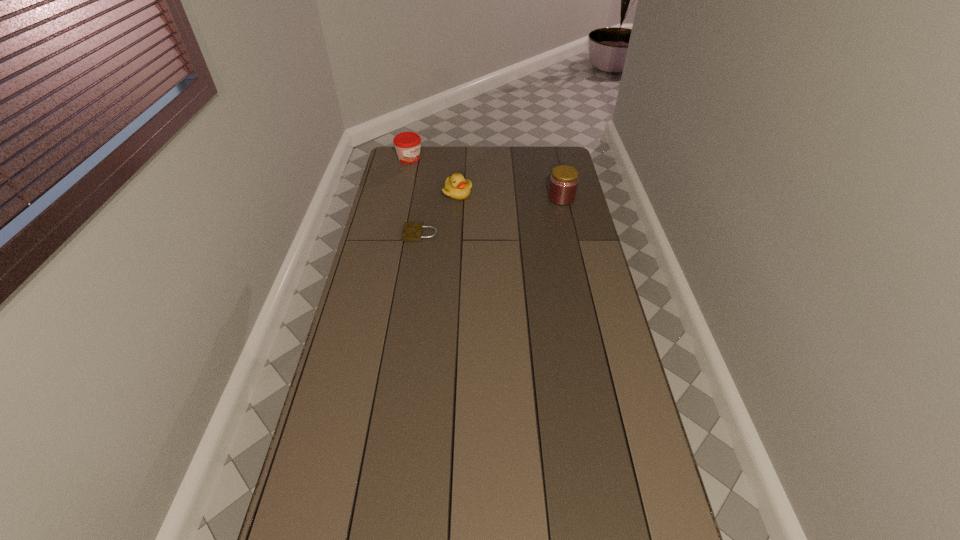
Where is `free region located on the front-facing side of the second object from right to left`? free region located on the front-facing side of the second object from right to left is located at coordinates (527, 220).

I want to click on free space located on the front-facing side of the second object from right to left, so click(x=507, y=212).

Image resolution: width=960 pixels, height=540 pixels. I want to click on vacant area situated 0.270m on the label side of the shorter jam, so click(x=456, y=183).

Locate an element on the screen. free space located on the label side of the shorter jam is located at coordinates (429, 168).

You are a GUI agent. You are given a task and a screenshot of the screen. Output one action in this format:
    pyautogui.click(x=<x>, y=<y>)
    Task: Click on the vacant space located 0.380m on the label side of the shorter jam
    This screenshot has width=960, height=540.
    Given the screenshot: What is the action you would take?
    pyautogui.click(x=472, y=192)

Locate an element on the screen. object positioned at the far edge is located at coordinates (407, 144).

Image resolution: width=960 pixels, height=540 pixels. I want to click on padlock situated at the left edge, so click(x=412, y=231).

Image resolution: width=960 pixels, height=540 pixels. Find the location of `jam that is at the left edge`. jam that is at the left edge is located at coordinates (407, 144).

This screenshot has height=540, width=960. In order to click on object that is positioned at the right edge in this screenshot , I will do `click(563, 184)`.

Find the location of a particular element. Image resolution: width=960 pixels, height=540 pixels. object that is at the far left corner is located at coordinates (407, 144).